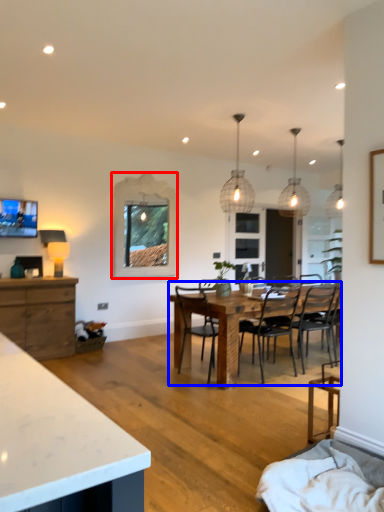
Question: Which object is further to the camera taking this photo, window (highlighted by a red box) or kitchen & dining room table (highlighted by a blue box)?

Choices:
 (A) window
 (B) kitchen & dining room table

Answer: (A)